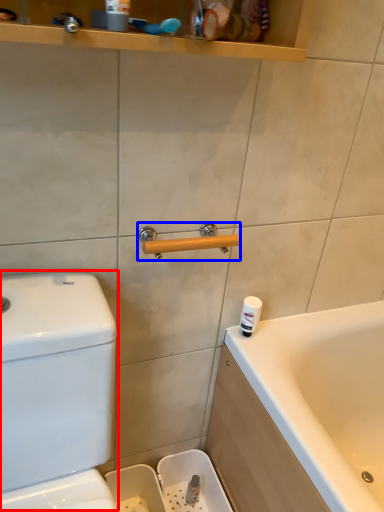
Question: Among these objects, which one is farthest to the camera, water tank (highlighted by a red box) or door handle (highlighted by a blue box)?

Choices:
 (A) water tank
 (B) door handle

Answer: (B)